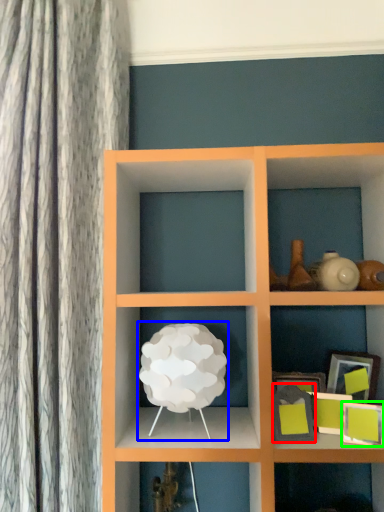
Question: Which is farther away from picture frame (highlighted by a red box)? table lamp (highlighted by a blue box) or picture frame (highlighted by a green box)?

Choices:
 (A) table lamp
 (B) picture frame

Answer: (A)